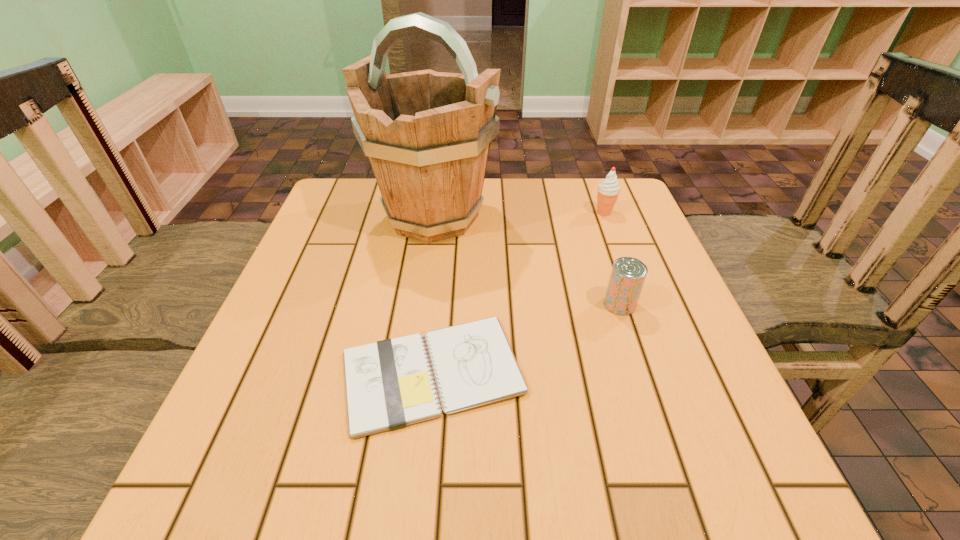
This screenshot has width=960, height=540. Identify the location of bucket that is at the far edge. (427, 134).

This screenshot has height=540, width=960. I want to click on icecream that is at the far edge, so click(x=608, y=191).

Locate an element on the screen. The width and height of the screenshot is (960, 540). object that is at the left edge is located at coordinates (427, 134).

Locate an element on the screen. The height and width of the screenshot is (540, 960). icecream that is at the right edge is located at coordinates (608, 191).

Locate an element on the screen. This screenshot has height=540, width=960. beer can situated at the right edge is located at coordinates (628, 274).

The width and height of the screenshot is (960, 540). What are the coordinates of `object that is positioned at the far left corner` in the screenshot? It's located at (427, 134).

Where is `object present at the far right corner`? This screenshot has height=540, width=960. object present at the far right corner is located at coordinates (608, 191).

In the image, there is a desktop. At what (x,y) coordinates should I click in order to perform the action: click on vacant space at the far edge. Please return your answer as a coordinate pair (x, y). Looking at the image, I should click on (522, 221).

Find the location of a particular element. This screenshot has height=540, width=960. free region at the near edge of the desktop is located at coordinates (303, 503).

Where is `free space at the left edge`? This screenshot has width=960, height=540. free space at the left edge is located at coordinates (336, 359).